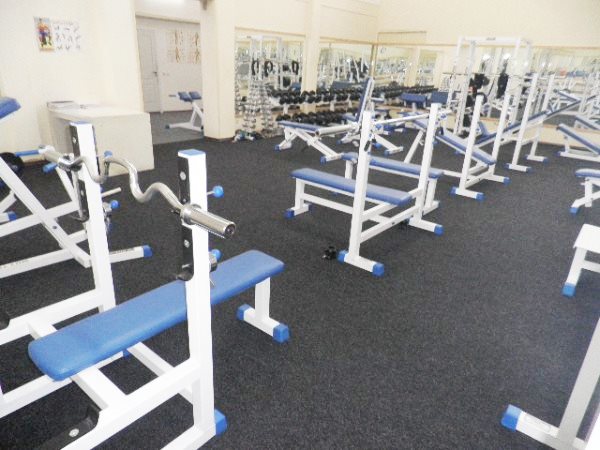
This screenshot has width=600, height=450. What are the coordinates of `mirrors` in the screenshot? It's located at pos(285,46), pos(351,55), pos(402,58), pos(442,61), pos(571,65).